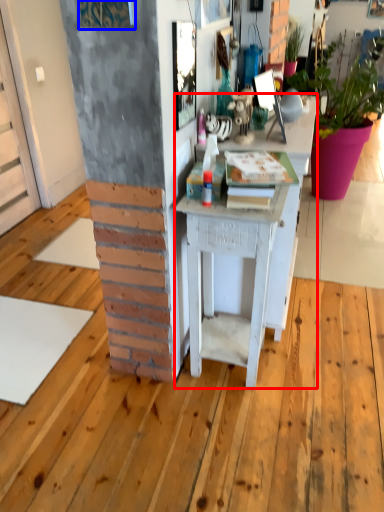
Question: Among these objects, which one is farthest to the camera, desk (highlighted by a red box) or picture frame (highlighted by a blue box)?

Choices:
 (A) desk
 (B) picture frame

Answer: (A)